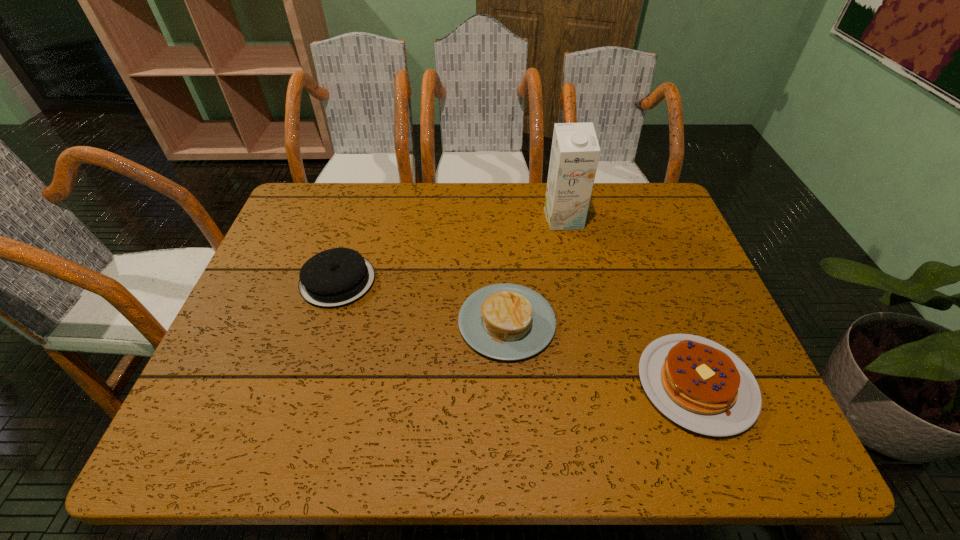
The height and width of the screenshot is (540, 960). I want to click on object that is at the near edge, so (699, 384).

Image resolution: width=960 pixels, height=540 pixels. Find the location of `object located in the left edge section of the desktop`. object located in the left edge section of the desktop is located at coordinates (x=336, y=277).

Find the location of `object positioned at the right edge`. object positioned at the right edge is located at coordinates (699, 384).

You are a GUI agent. You are given a task and a screenshot of the screen. Output one action in this format:
    pyautogui.click(x=<x>, y=<y>)
    Task: Click on the object located in the near right corner section of the desktop
    
    Given the screenshot: What is the action you would take?
    pyautogui.click(x=699, y=384)

At what (x,y) coordinates should I click in order to perform the action: click on free point at the far edge. Please return your answer as a coordinate pair (x, y). Looking at the image, I should click on (397, 202).

Find the location of a particular element. The height and width of the screenshot is (540, 960). free point at the near edge is located at coordinates (681, 451).

Locate an element on the screen. The image size is (960, 540). vacant area at the left edge of the desktop is located at coordinates (203, 397).

In the image, there is a desktop. Where is `free space at the right edge`? This screenshot has width=960, height=540. free space at the right edge is located at coordinates click(x=682, y=234).

You are a GUI agent. You are given a task and a screenshot of the screen. Output one action in this format:
    pyautogui.click(x=<x>, y=<y>)
    Task: Click on the free spot at the far left corner of the desktop
    The height and width of the screenshot is (540, 960).
    Given the screenshot: What is the action you would take?
    pyautogui.click(x=315, y=207)

Identify the location of blank space at the far right corner of the desktop. pyautogui.click(x=619, y=210).